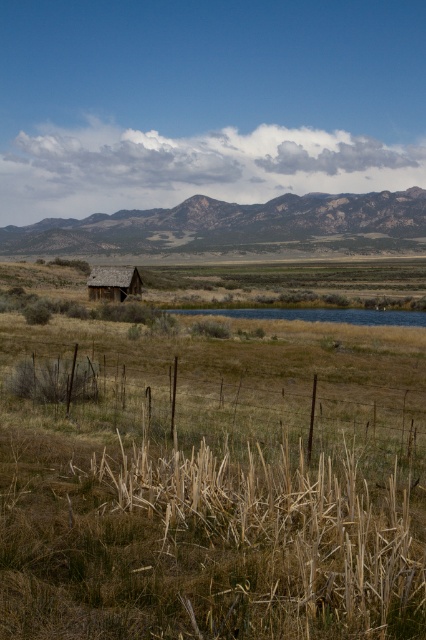
Can you confirm if rocky brown mountain at center is bigger than brown wooden hut at left?

Yes.

Looking at this image, between rocky brown mountain at center and brown wooden hut at left, which one appears on the right side from the viewer's perspective?

Positioned to the right is rocky brown mountain at center.

The height and width of the screenshot is (640, 426). What do you see at coordinates (224, 224) in the screenshot?
I see `rocky brown mountain at center` at bounding box center [224, 224].

Where is `rocky brown mountain at center`? The image size is (426, 640). rocky brown mountain at center is located at coordinates (224, 224).